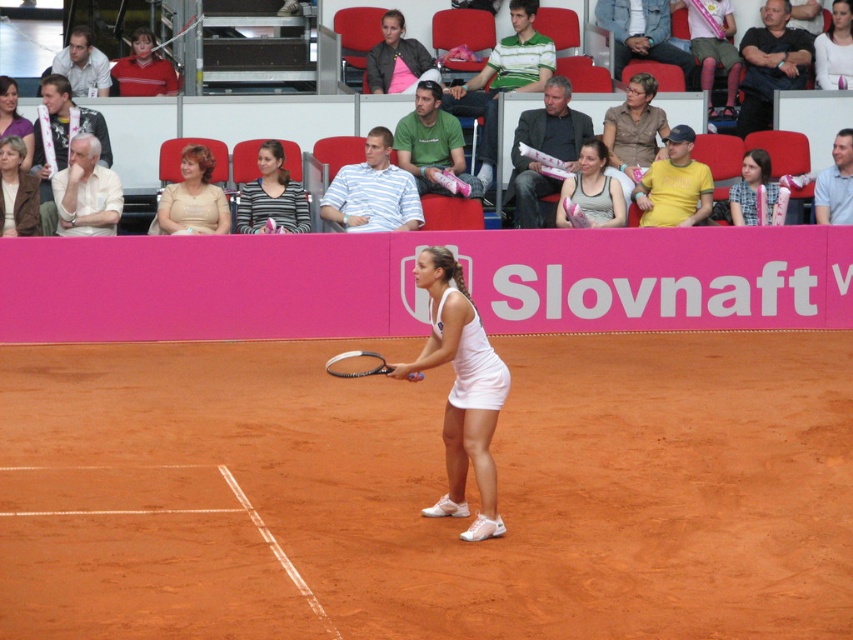
You are a photographer trying to capture the tennis player in focus. Since the matte gray tank top at center and the matte white tennis skirt at center are both in the same area, which part of the outfit will appear smaller in the photo?

The matte gray tank top at center will appear smaller in the photo because it occupies less space than the matte white tennis skirt at center.

You are a photographer trying to capture a closeup of the black rubber tennis racket at center. However, the brown leather jacket at upper left is blocking your view. Can you estimate whether the jacket is big enough to completely cover the racket in the photo?

The brown leather jacket at upper left is larger in size than black rubber tennis racket at center. Therefore, the jacket could potentially block the entire racket from view if positioned directly in front of it.

You are a photographer trying to capture the player wearing both the matte gray tank top at center and the smooth white tank top at center in one shot. Which tank top should you focus on first to ensure both are in frame?

The matte gray tank top at center is positioned on the left side of smooth white tank top at center, so focusing on the leftmost tank top first will ensure both are in frame.